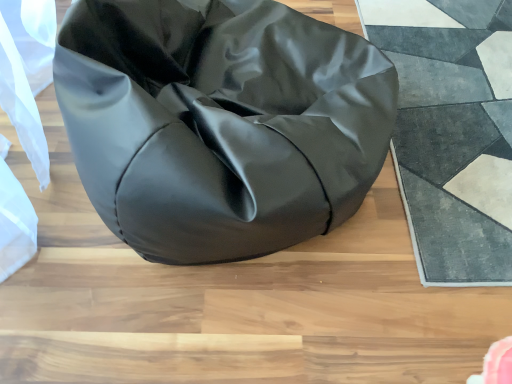
Question: Is matte black bean bag at center to the right of textured gray rug at right from the viewer's perspective?

Choices:
 (A) no
 (B) yes

Answer: (A)

Question: Is matte black bean bag at center not close to textured gray rug at right?

Choices:
 (A) yes
 (B) no

Answer: (B)

Question: From the image's perspective, is matte black bean bag at center located beneath textured gray rug at right?

Choices:
 (A) yes
 (B) no

Answer: (B)

Question: Is matte black bean bag at center not within textured gray rug at right?

Choices:
 (A) no
 (B) yes

Answer: (B)

Question: Is matte black bean bag at center facing towards textured gray rug at right?

Choices:
 (A) yes
 (B) no

Answer: (B)

Question: Is matte black bean bag at center smaller than textured gray rug at right?

Choices:
 (A) yes
 (B) no

Answer: (B)

Question: Does textured gray rug at right have a larger size compared to matte black bean bag at center?

Choices:
 (A) yes
 (B) no

Answer: (B)

Question: From a real-world perspective, is textured gray rug at right below matte black bean bag at center?

Choices:
 (A) yes
 (B) no

Answer: (A)

Question: From a real-world perspective, is textured gray rug at right positioned over matte black bean bag at center based on gravity?

Choices:
 (A) no
 (B) yes

Answer: (A)

Question: Is matte black bean bag at center inside textured gray rug at right?

Choices:
 (A) no
 (B) yes

Answer: (A)

Question: Can you see textured gray rug at right touching matte black bean bag at center?

Choices:
 (A) yes
 (B) no

Answer: (B)

Question: Is textured gray rug at right closer to the viewer compared to matte black bean bag at center?

Choices:
 (A) no
 (B) yes

Answer: (A)

Question: In terms of size, does textured gray rug at right appear bigger or smaller than matte black bean bag at center?

Choices:
 (A) big
 (B) small

Answer: (B)